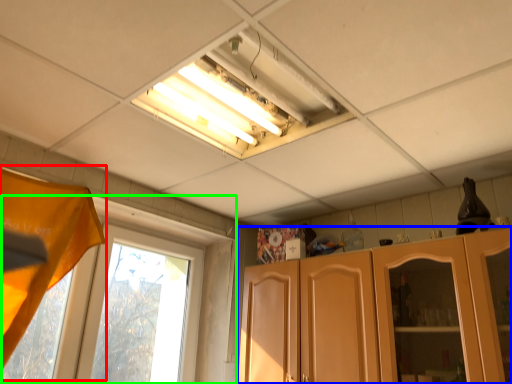
Question: Based on their relative distances, which object is farther from curtain (highlighted by a red box)? Choose from cabinetry (highlighted by a blue box) and window (highlighted by a green box).

Choices:
 (A) cabinetry
 (B) window

Answer: (A)